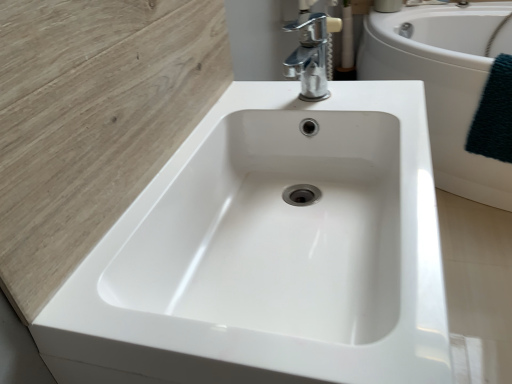
At what (x,y) coordinates should I click in order to perform the action: click on white glossy sink at center. Please return your answer as a coordinate pair (x, y). The width and height of the screenshot is (512, 384). Looking at the image, I should click on (289, 227).

Measure the distance between point [322,81] and camera.

The depth of point [322,81] is 31.14 inches.

What do you see at coordinates (311, 54) in the screenshot? I see `chrome metallic faucet at upper center` at bounding box center [311, 54].

Identify the location of dark green textured towel at right. The height and width of the screenshot is (384, 512). (494, 114).

The image size is (512, 384). Identify the location of white glossy sink at center. (289, 227).

Measure the distance between chrome metallic faucet at upper center and dark green textured towel at right.

chrome metallic faucet at upper center and dark green textured towel at right are 28.27 inches apart.

Is chrome metallic faucet at upper center not close to dark green textured towel at right?

No, there isn't a large distance between chrome metallic faucet at upper center and dark green textured towel at right.

Would you say chrome metallic faucet at upper center is outside dark green textured towel at right?

chrome metallic faucet at upper center lies outside dark green textured towel at right's area.

From the image's perspective, which one is positioned higher, chrome metallic faucet at upper center or dark green textured towel at right?

dark green textured towel at right is shown above in the image.

In the scene shown: Are white glossy bathtub at center and chrome metallic faucet at upper center located far from each other?

That's not correct — white glossy bathtub at center is a little close to chrome metallic faucet at upper center.

This screenshot has width=512, height=384. What are the coordinates of `tap lying on the left of white glossy bathtub at center` in the screenshot? It's located at (311, 54).

Is point (449, 153) less distant than point (323, 39)?

No, it is not.

Is chrome metallic faucet at upper center at the back of white glossy bathtub at center?

No, white glossy bathtub at center's orientation is not away from chrome metallic faucet at upper center.

Which is closer to the camera, (495, 122) or (176, 257)?

Point (495, 122) appears to be farther away from the viewer than point (176, 257).

Is the depth of dark green textured towel at right less than that of white glossy sink at center?

No, dark green textured towel at right is further to the viewer.

Is dark green textured towel at right not close to white glossy sink at center?

Yes.

Is dark green textured towel at right to the left or to the right of white glossy sink at center in the image?

In the image, dark green textured towel at right appears on the right side of white glossy sink at center.

Consider the image. Is chrome metallic faucet at upper center wider than white glossy sink at center?

No, chrome metallic faucet at upper center is not wider than white glossy sink at center.

Is chrome metallic faucet at upper center bigger or smaller than white glossy sink at center?

Considering their sizes, chrome metallic faucet at upper center takes up less space than white glossy sink at center.

Considering the positions of points (326, 38) and (298, 241), is point (326, 38) closer to camera compared to point (298, 241)?

No, (326, 38) is further to viewer.

Does chrome metallic faucet at upper center lie in front of white glossy sink at center?

No.

Does white glossy sink at center have a greater height compared to chrome metallic faucet at upper center?

Incorrect, the height of white glossy sink at center is not larger of that of chrome metallic faucet at upper center.

In the image, is white glossy sink at center positioned in front of or behind chrome metallic faucet at upper center?

white glossy sink at center is positioned closer to the viewer than chrome metallic faucet at upper center.

Is white glossy sink at center touching chrome metallic faucet at upper center?

No, white glossy sink at center is not next to chrome metallic faucet at upper center.

Is white glossy sink at center looking in the opposite direction of chrome metallic faucet at upper center?

No, white glossy sink at center is not facing the opposite direction of chrome metallic faucet at upper center.

Which is closer, [451,165] or [510,136]?

Point [451,165].

From their relative heights in the image, would you say white glossy bathtub at center is taller or shorter than dark green textured towel at right?

Clearly, white glossy bathtub at center is taller compared to dark green textured towel at right.

Looking at this image, would you say white glossy bathtub at center is inside or outside dark green textured towel at right?

white glossy bathtub at center is not inside dark green textured towel at right, it's outside.

Considering the relative positions of white glossy bathtub at center and dark green textured towel at right in the image provided, is white glossy bathtub at center to the right of dark green textured towel at right from the viewer's perspective?

No.

Between white glossy sink at center and dark green textured towel at right, which one appears on the left side from the viewer's perspective?

white glossy sink at center is more to the left.

From a real-world perspective, is white glossy sink at center positioned over dark green textured towel at right based on gravity?

Yes, from a real-world perspective, white glossy sink at center is over dark green textured towel at right

Considering the relative positions of white glossy sink at center and dark green textured towel at right in the image provided, is white glossy sink at center in front of dark green textured towel at right?

Yes, it is in front of dark green textured towel at right.

You are a GUI agent. You are given a task and a screenshot of the screen. Output one action in this format:
    pyautogui.click(x=<x>, y=<y>)
    Task: Click on the tap above the dark green textured towel at right (from a real-world perspective)
    Image resolution: width=512 pixels, height=384 pixels.
    Given the screenshot: What is the action you would take?
    pyautogui.click(x=311, y=54)

The image size is (512, 384). In the image, there is a chrome metallic faucet at upper center. Find the location of `bath below it (from a real-world perspective)`. bath below it (from a real-world perspective) is located at coordinates (445, 83).

Which object lies nearer to the anchor point white glossy bathtub at center, chrome metallic faucet at upper center or dark green textured towel at right?

dark green textured towel at right lies closer to white glossy bathtub at center than the other object.

From the image, which object appears to be nearer to dark green textured towel at right, white glossy bathtub at center or chrome metallic faucet at upper center?

The object closer to dark green textured towel at right is white glossy bathtub at center.

Consider the image. When comparing their distances from white glossy sink at center, does chrome metallic faucet at upper center or dark green textured towel at right seem further?

dark green textured towel at right is positioned further to the anchor white glossy sink at center.

Considering their positions, is dark green textured towel at right positioned further to white glossy sink at center than white glossy bathtub at center?

white glossy bathtub at center is further to white glossy sink at center.

Which object lies further to the anchor point white glossy bathtub at center, dark green textured towel at right or chrome metallic faucet at upper center?

The object further to white glossy bathtub at center is chrome metallic faucet at upper center.

From the image, which object appears to be nearer to white glossy bathtub at center, dark green textured towel at right or white glossy sink at center?

The object closer to white glossy bathtub at center is dark green textured towel at right.

Based on their spatial positions, is dark green textured towel at right or chrome metallic faucet at upper center further from white glossy sink at center?

dark green textured towel at right is further to white glossy sink at center.

From the image, which object appears to be nearer to dark green textured towel at right, white glossy bathtub at center or white glossy sink at center?

white glossy bathtub at center.

The width and height of the screenshot is (512, 384). In order to click on tap between white glossy sink at center and white glossy bathtub at center in this screenshot , I will do `click(311, 54)`.

Identify the location of tap located between white glossy sink at center and dark green textured towel at right in the depth direction. (311, 54).

This screenshot has width=512, height=384. Find the location of `bath between chrome metallic faucet at upper center and dark green textured towel at right from left to right`. bath between chrome metallic faucet at upper center and dark green textured towel at right from left to right is located at coordinates (445, 83).

The image size is (512, 384). Identify the location of bath between white glossy sink at center and dark green textured towel at right along the z-axis. (445, 83).